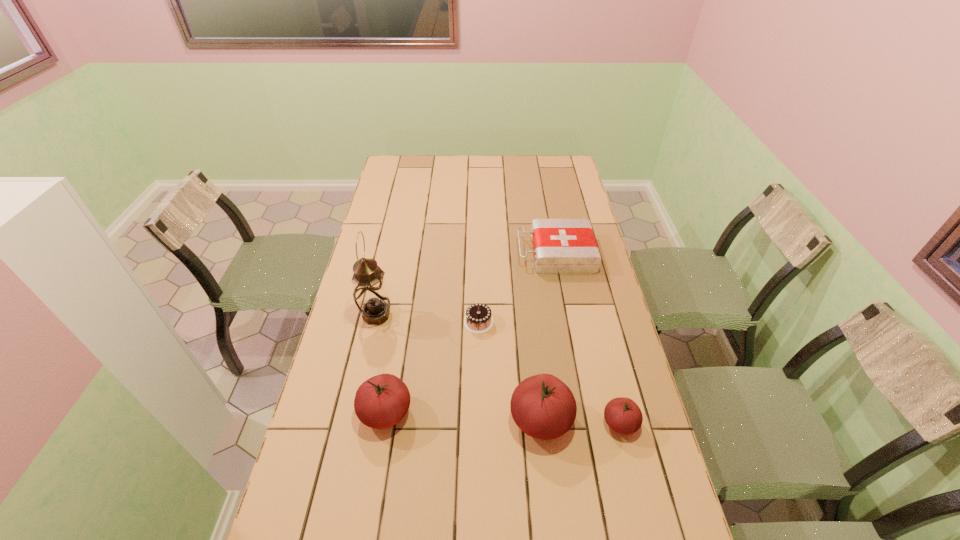
Identify the location of vacant region at the near edge of the desktop. coord(467,513).

Find the location of a particular element. The image size is (960, 540). vacant space at the left edge is located at coordinates (309, 439).

This screenshot has height=540, width=960. I want to click on vacant space at the right edge, so click(614, 448).

At what (x,y) coordinates should I click in order to perform the action: click on free space at the far left corner of the desktop. Please return your answer as a coordinate pair (x, y). The image size is (960, 540). Looking at the image, I should click on (392, 180).

Locate an element on the screen. This screenshot has height=540, width=960. vacant space at the far right corner of the desktop is located at coordinates (567, 157).

The height and width of the screenshot is (540, 960). In order to click on unoccupied position between the leftmost tomato and the farthest object in this screenshot , I will do `click(470, 333)`.

At what (x,y) coordinates should I click in order to perform the action: click on free spot between the farthest object and the chocolate cake. Please return your answer as a coordinate pair (x, y). This screenshot has height=540, width=960. Looking at the image, I should click on (517, 288).

Image resolution: width=960 pixels, height=540 pixels. What are the coordinates of `free space between the farthest object and the third object from left to right` in the screenshot? It's located at (517, 288).

In order to click on free space between the farthest object and the second tomato from right to left in this screenshot , I will do `click(548, 336)`.

Identify the location of empty space that is in between the oil lamp and the second tallest tomato. (381, 363).